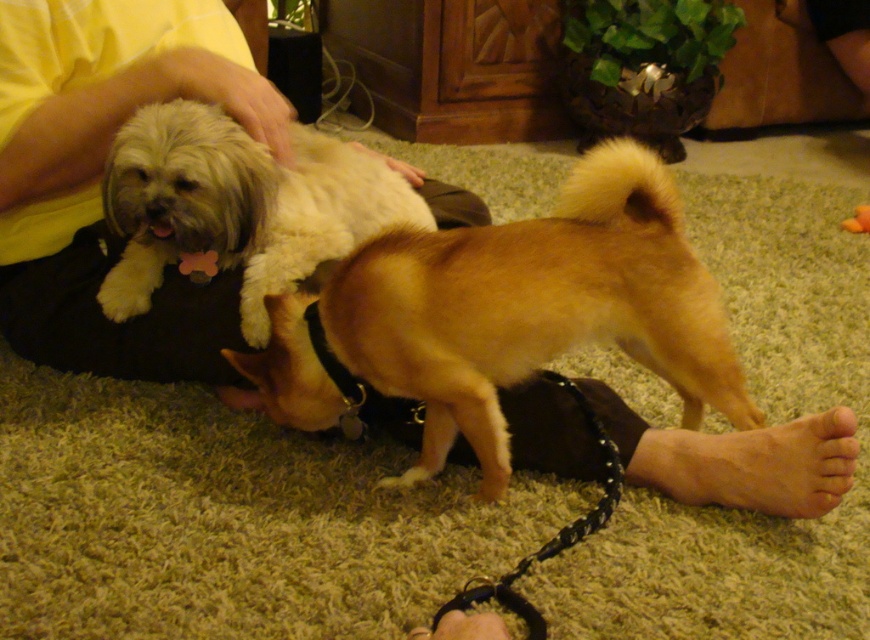
You are standing at the position of the person in the image and want to reach a treat located at one of the two points. Which point is closer to you, point (202, 193) or point (631, 454)?

Point (202, 193) is closer to you because it is in front of point (631, 454).

You are a delivery robot entering the room and need to avoid stepping on any objects. The light brown fur at center and the skinny barefoot at lower right are both in your path. Which object should you avoid stepping on first?

The light brown fur at center is in front of the skinny barefoot at lower right, so you should avoid stepping on the light brown fur at center first.